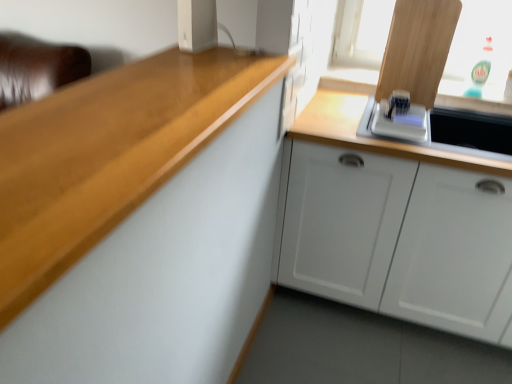
Locate an element on the screen. This screenshot has width=512, height=384. free space in front of white plastic toaster at upper right, which is the second appliance from left to right is located at coordinates (415, 143).